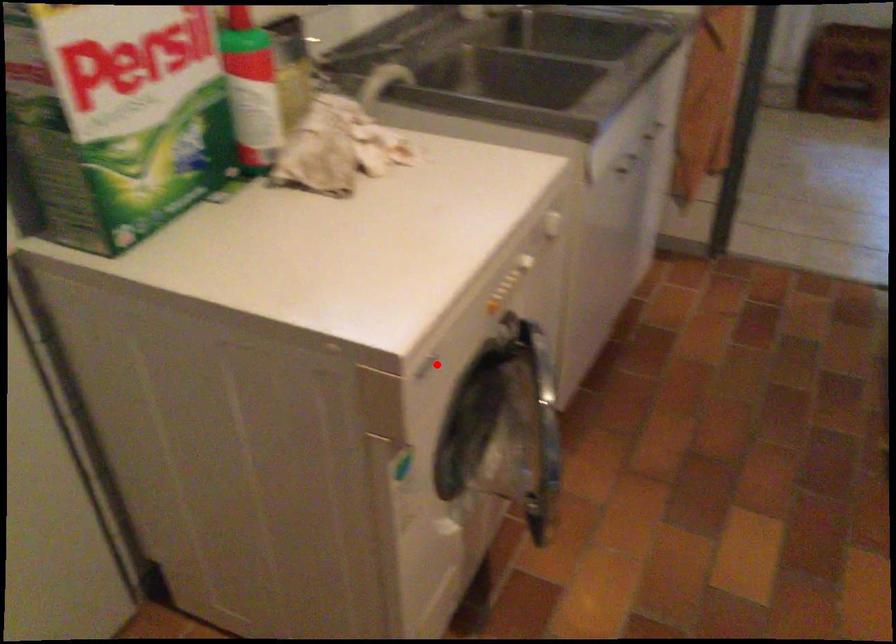
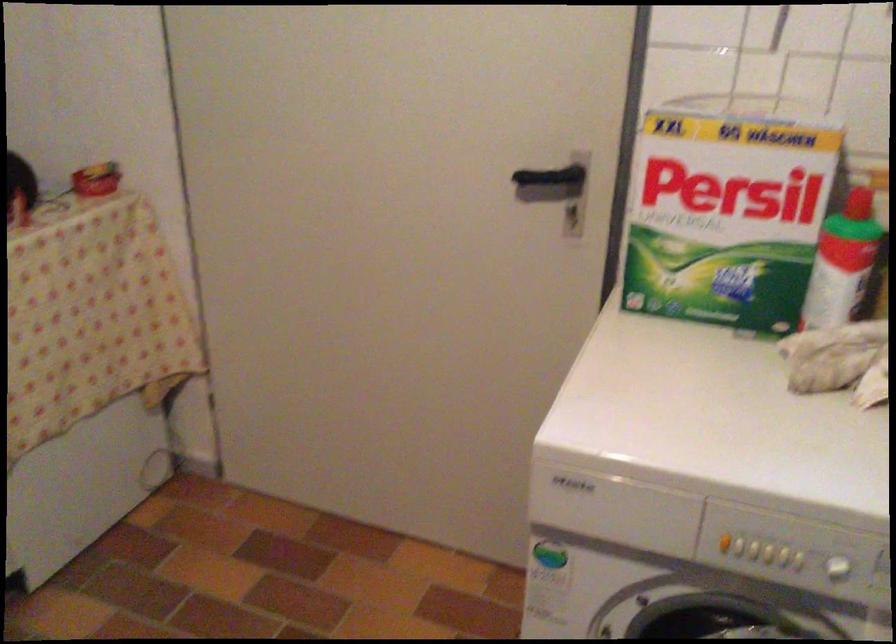
Locate, in the second image, the point that corresponds to the highlighted location in the first image.

(615, 509)